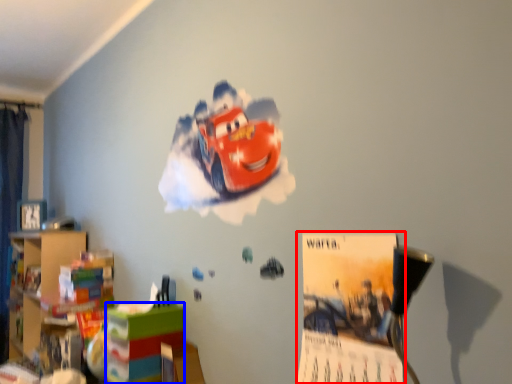
Question: Which point is closer to the camera, poster page (highlighted by a red box) or shelf (highlighted by a blue box)?

Choices:
 (A) poster page
 (B) shelf

Answer: (A)